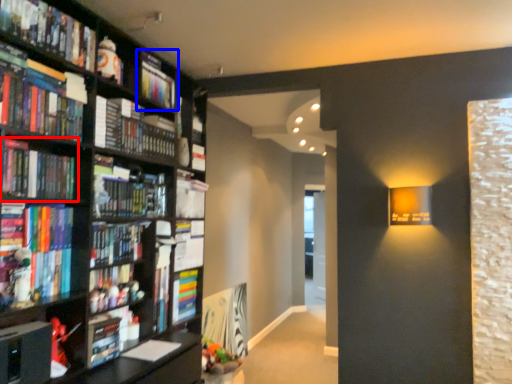
Question: Which object appears closest to the camera in this image, book (highlighted by a red box) or book (highlighted by a blue box)?

Choices:
 (A) book
 (B) book

Answer: (A)